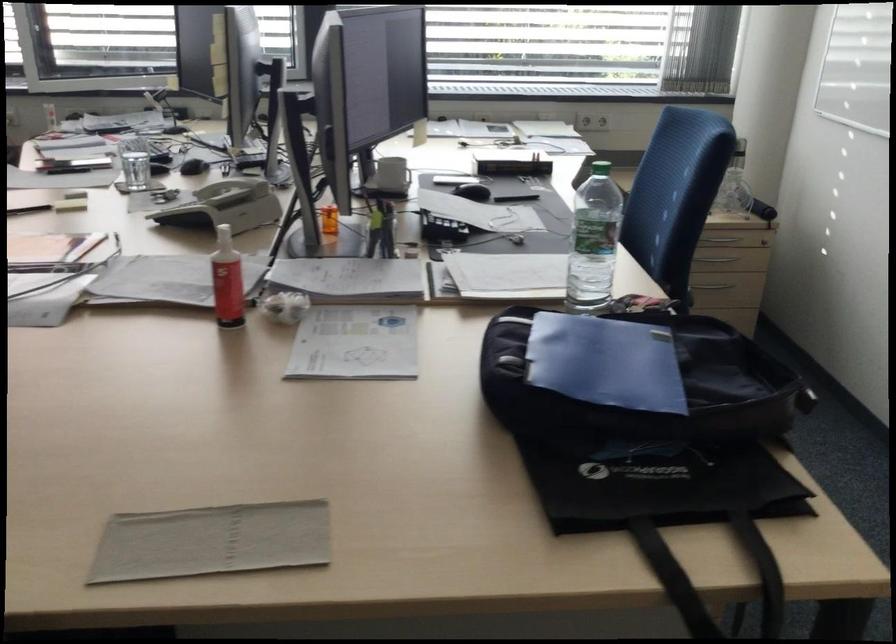
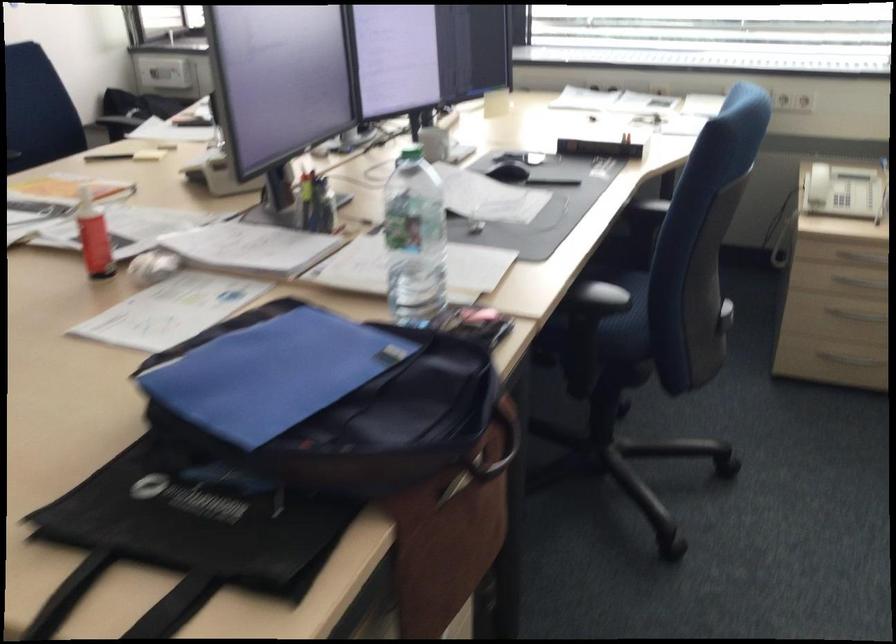
Question: The camera is either moving clockwise (left) or counter-clockwise (right) around the object. The first image is from the beginning of the video and the second image is from the end. Is the camera moving left or right when shooting the video?

Choices:
 (A) Left
 (B) Right

Answer: (B)